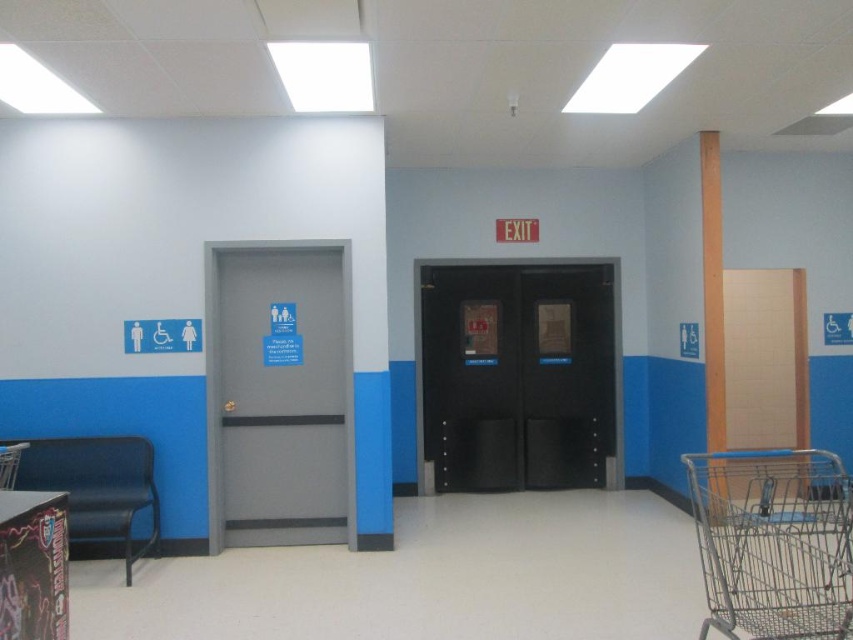
Question: Is black metal elevator at center thinner than gray matte door at left?

Choices:
 (A) no
 (B) yes

Answer: (A)

Question: Which point is closer to the camera taking this photo?

Choices:
 (A) (136, 445)
 (B) (718, 321)
 (C) (13, 451)
 (D) (598, 397)

Answer: (C)

Question: Can you confirm if gray matte door at left is positioned below metallic blue chair at lower left?

Choices:
 (A) yes
 (B) no

Answer: (B)

Question: Which object is positioned farthest from the metallic blue chair at lower left?

Choices:
 (A) wooden pillar at right
 (B) black metal elevator at center
 (C) metallic blue bench at left

Answer: (A)

Question: Which of the following is the closest to the observer?

Choices:
 (A) (74, 496)
 (B) (209, 396)
 (C) (711, 388)

Answer: (A)

Question: Does metallic silver shopping cart at lower right appear on the right side of gray matte door at left?

Choices:
 (A) yes
 (B) no

Answer: (A)